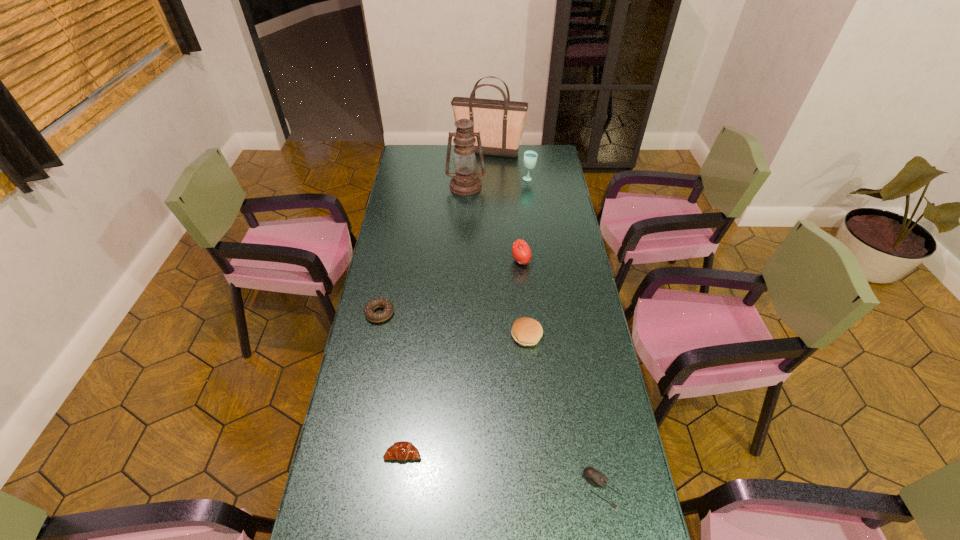
This screenshot has width=960, height=540. Identify the location of the farthest object. (501, 123).

This screenshot has height=540, width=960. I want to click on oil lamp, so click(465, 181).

Locate an element on the screen. glass is located at coordinates (530, 157).

Identify the location of apple. (521, 251).

Locate an element on the screen. The image size is (960, 540). the fourth farthest object is located at coordinates (521, 251).

You are a GUI agent. You are given a task and a screenshot of the screen. Output one action in this format:
    pyautogui.click(x=<x>, y=<y>)
    Task: Click on the fifth tallest object
    The image size is (960, 540).
    Given the screenshot: What is the action you would take?
    pyautogui.click(x=526, y=331)

Identify the location of doughnut. Image resolution: width=960 pixels, height=540 pixels. (387, 306).

This screenshot has width=960, height=540. I want to click on the second nearest object, so click(x=402, y=450).

Find the location of a particular element. the shortest object is located at coordinates (594, 477).

At what (x,y) coordinates should I click in order to perform the action: click on the rightmost object. Please return your answer as a coordinate pair (x, y). Image resolution: width=960 pixels, height=540 pixels. Looking at the image, I should click on (594, 477).